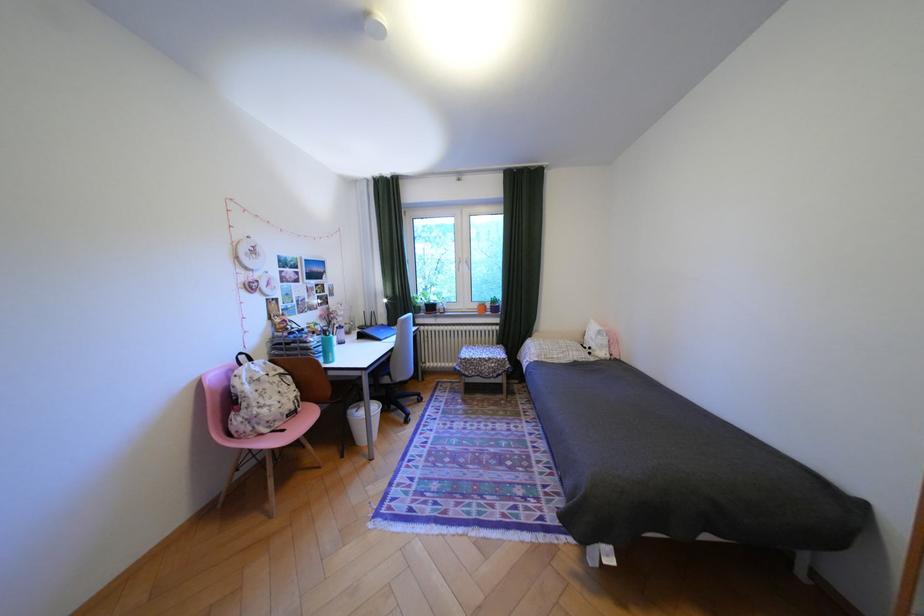
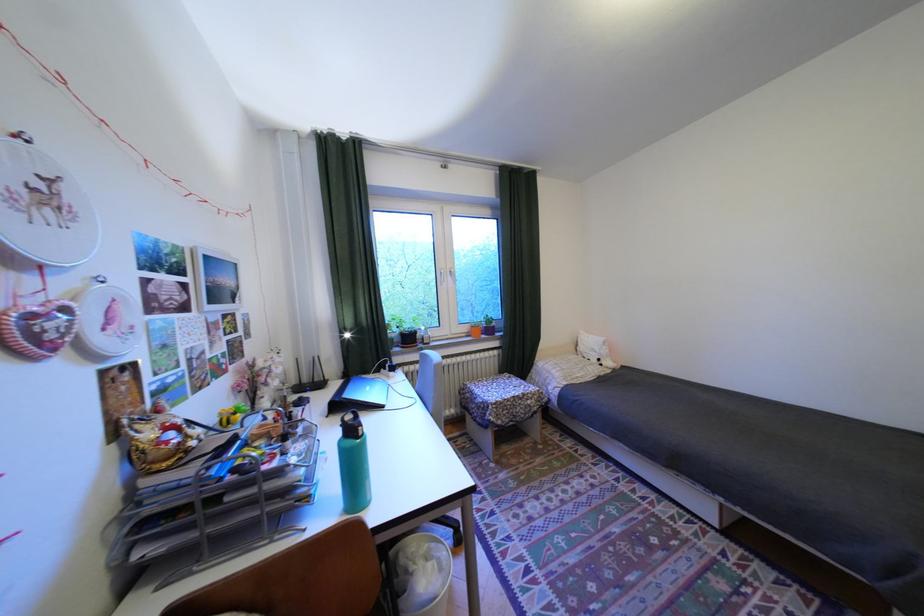
In the second image, find the point that corresponds to (602,349) in the first image.

(611, 360)